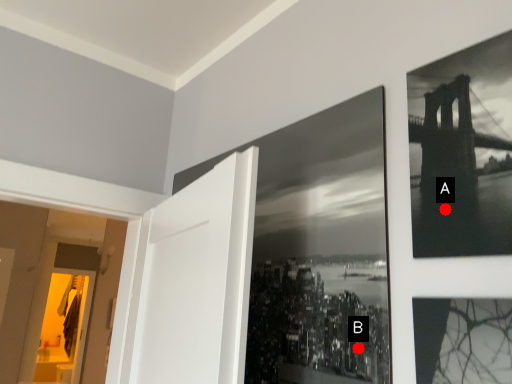
Question: Two points are circled on the image, labeled by A and B beside each circle. Which of the following is the farthest from the observer?

Choices:
 (A) A is further
 (B) B is further

Answer: (B)